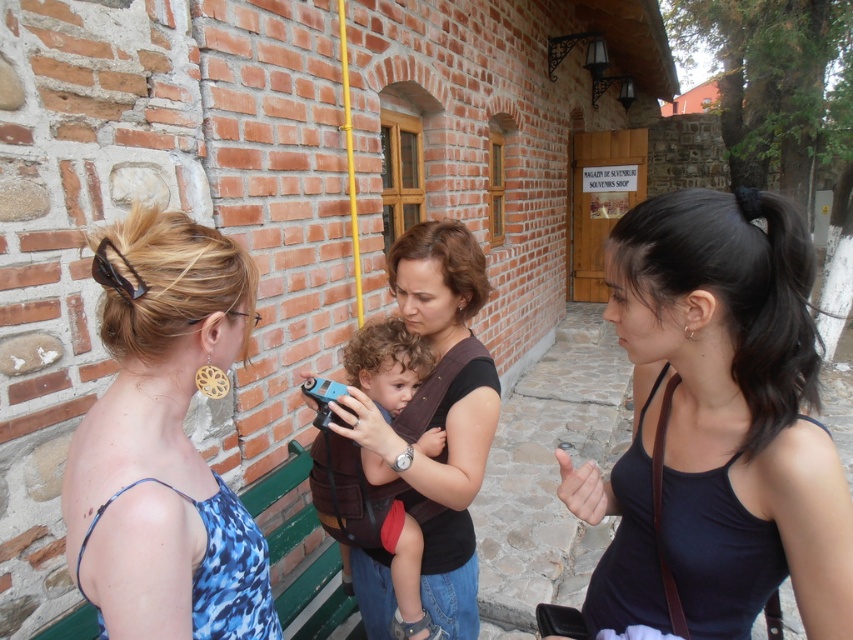
Question: Which is farther from the blue printed dress at center?

Choices:
 (A) black fabric tank top at center
 (B) blue plastic toy car at center

Answer: (A)

Question: Which of the following is the closest to the observer?

Choices:
 (A) click(746, 264)
 (B) click(380, 372)

Answer: (A)

Question: Can you confirm if black fabric tank top at center is wider than blue plastic toy car at center?

Choices:
 (A) yes
 (B) no

Answer: (A)

Question: Does blue printed dress at center appear on the right side of blue plastic toy car at center?

Choices:
 (A) yes
 (B) no

Answer: (B)

Question: Which object is closer to the camera taking this photo?

Choices:
 (A) blue printed dress at center
 (B) blue plastic toy car at center
 (C) black fabric tank top at center

Answer: (A)

Question: Where is black fabric tank top at center located in relation to blue printed dress at center in the image?

Choices:
 (A) right
 (B) left

Answer: (A)